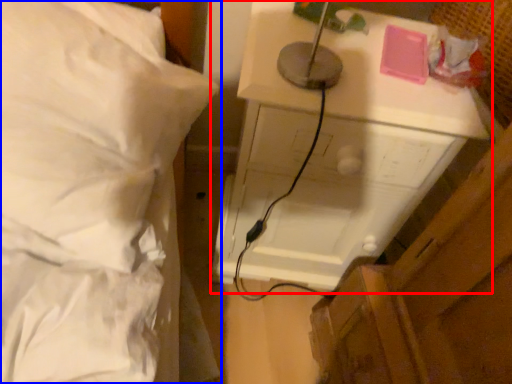
Question: Which object appears closest to the camera in this image, furniture (highlighted by a red box) or bed (highlighted by a blue box)?

Choices:
 (A) furniture
 (B) bed

Answer: (B)